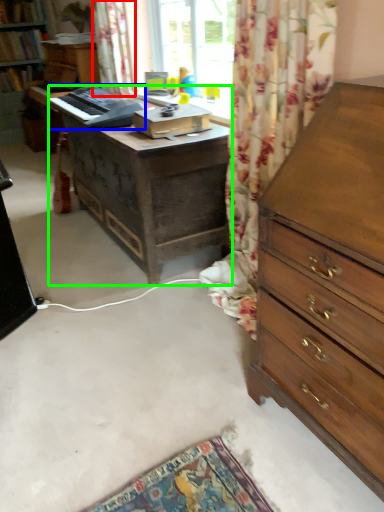
Question: Based on their relative distances, which object is farther from curtain (highlighted by a red box)? Choose from equipment (highlighted by a blue box) and desk (highlighted by a green box).

Choices:
 (A) equipment
 (B) desk

Answer: (B)